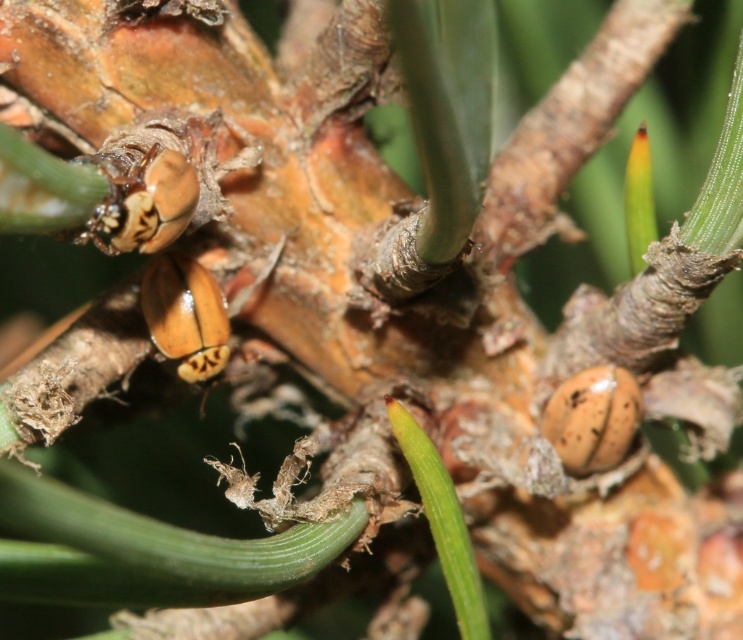
Which is below, brown matte beetle at center or yellow-orange shell beetle at center?

yellow-orange shell beetle at center

Which is in front, point (197, 198) or point (152, 301)?

Point (197, 198) is in front.

The width and height of the screenshot is (743, 640). I want to click on brown matte beetle at center, so click(143, 202).

Identify the location of brown matte beetle at center. This screenshot has height=640, width=743. [143, 202].

Between brown matte beetle at center and brown spotted shell at lower right, which one is positioned higher?

brown matte beetle at center

Does brown matte beetle at center appear on the left side of brown spotted shell at lower right?

Correct, you'll find brown matte beetle at center to the left of brown spotted shell at lower right.

Identify the location of brown matte beetle at center. (143, 202).

The width and height of the screenshot is (743, 640). What are the coordinates of `brown matte beetle at center` in the screenshot? It's located at (143, 202).

This screenshot has height=640, width=743. Describe the element at coordinates (184, 316) in the screenshot. I see `yellow-orange shell beetle at center` at that location.

Based on the photo, can you confirm if yellow-orange shell beetle at center is wider than brown spotted shell at lower right?

No.

Where is `yellow-orange shell beetle at center`? yellow-orange shell beetle at center is located at coordinates (184, 316).